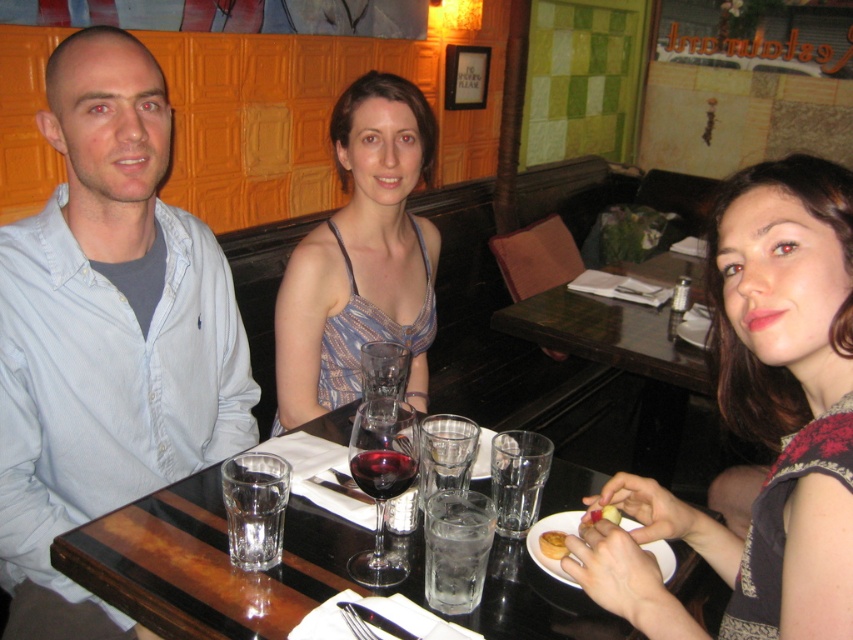
Question: Which of the following is the closest to the observer?

Choices:
 (A) (737, 538)
 (B) (369, 493)
 (C) (593, 512)
 (D) (207, 627)

Answer: (D)

Question: Is brown wooden table at center smaller than ruby glass at center?

Choices:
 (A) no
 (B) yes

Answer: (A)

Question: Which point is farther to the camera?

Choices:
 (A) (389, 449)
 (B) (381, 556)
 (C) (59, 109)

Answer: (C)

Question: Does ruby glass at center appear over smooth apple at lower right?

Choices:
 (A) no
 (B) yes

Answer: (B)

Question: In this image, where is golden crispy pastry at lower center located relative to smooth apple at lower right?

Choices:
 (A) below
 (B) above

Answer: (A)

Question: Which object appears closest to the camera in this image?

Choices:
 (A) smooth apple at lower right
 (B) golden crispy pastry at lower center

Answer: (A)